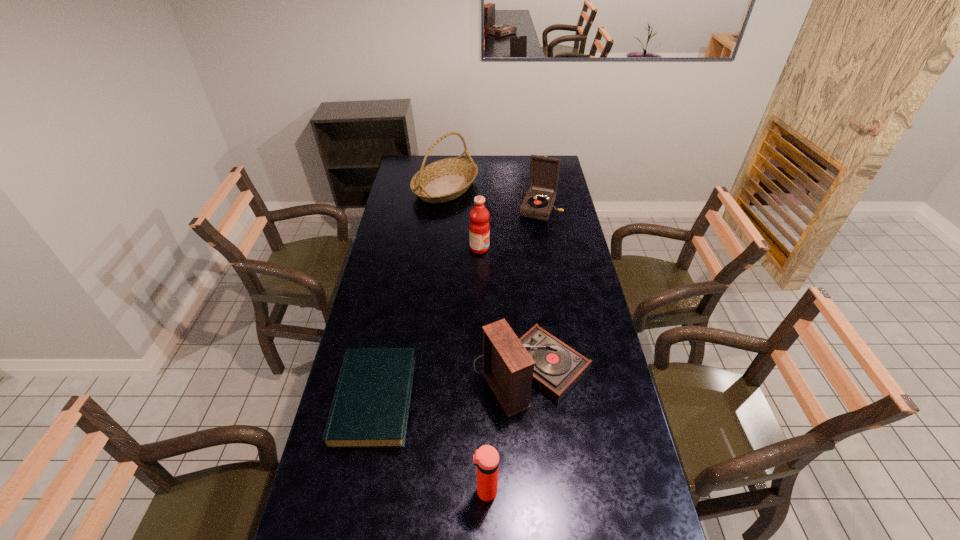
Identify the location of vacant point that satisfies the following two spatial constraints: 1. on the back side of the book; 2. on the right side of the basket. (416, 188).